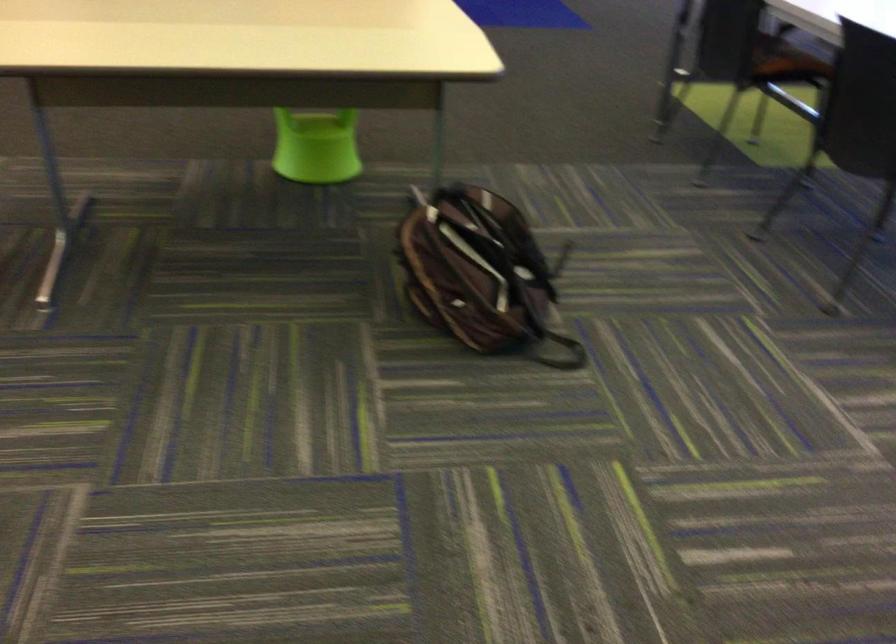
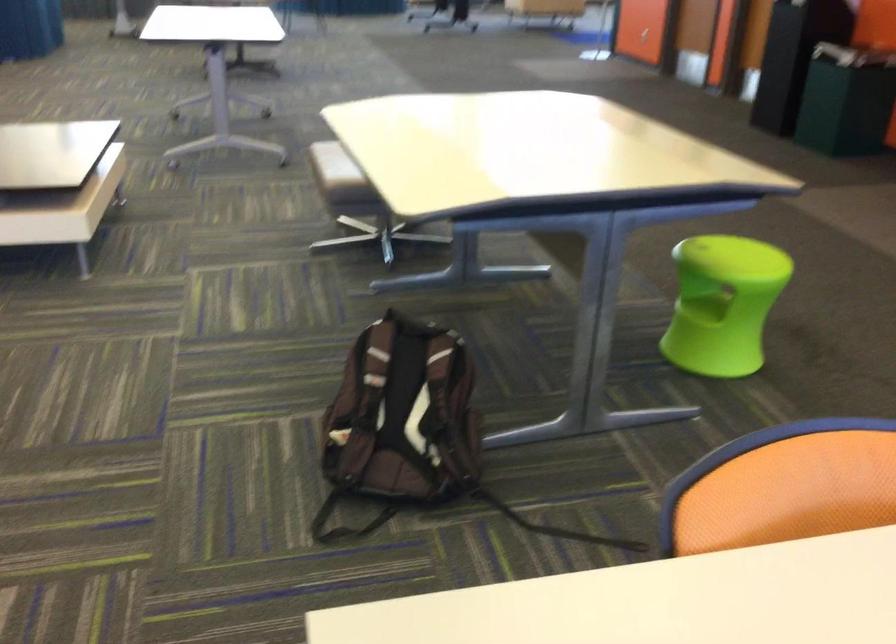
In the second image, find the point that corresponds to (x=324, y=122) in the first image.

(702, 307)